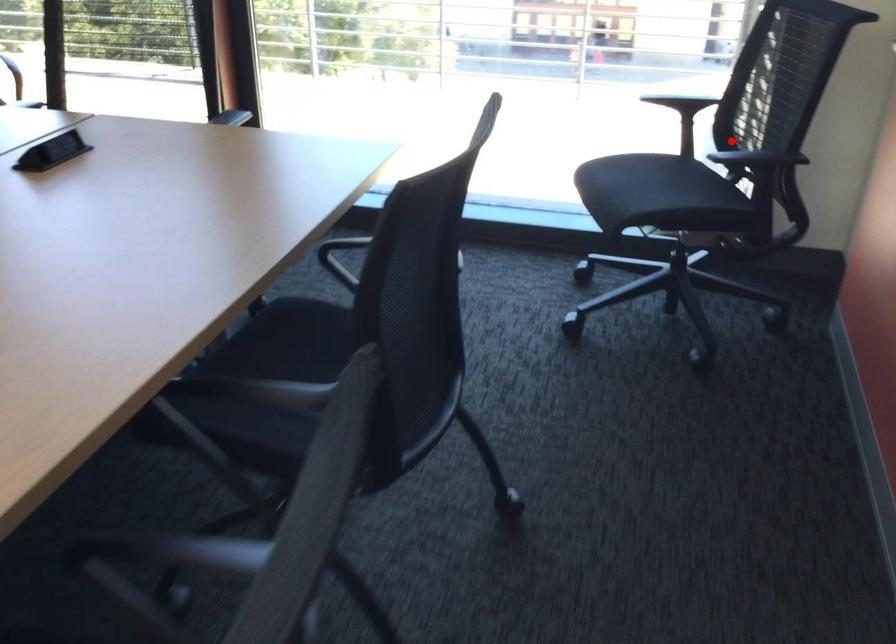
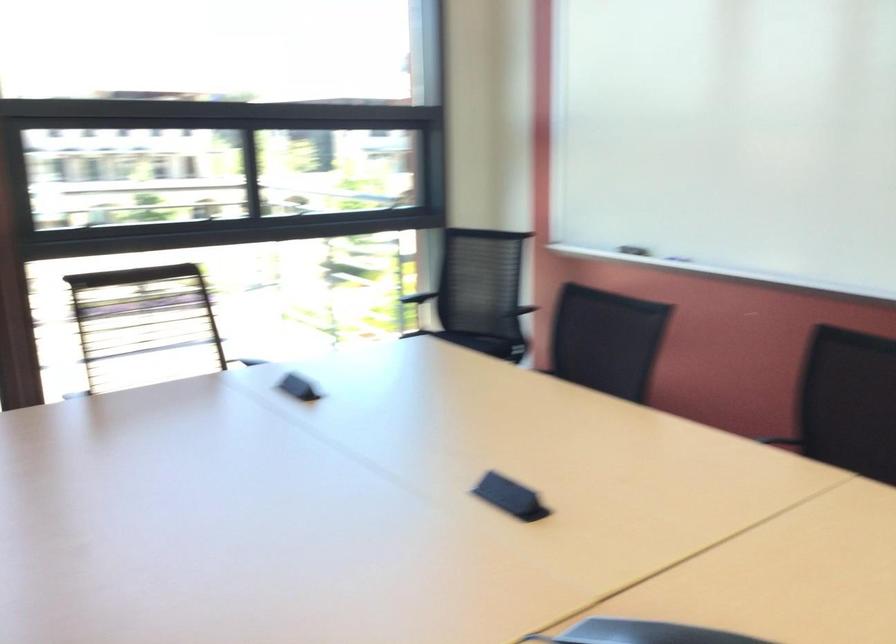
Where in the second image is the point corresponding to the highlighted location from the first image?

(504, 308)